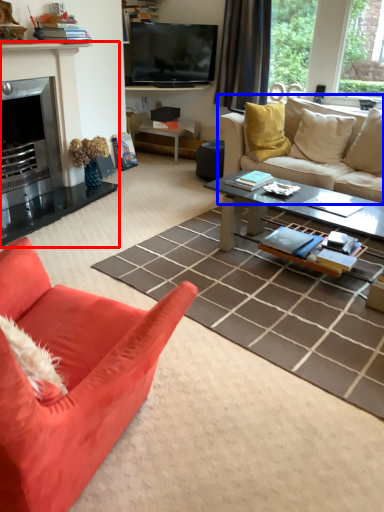
Question: Which object is further to the camera taking this photo, fireplace (highlighted by a red box) or studio couch (highlighted by a blue box)?

Choices:
 (A) fireplace
 (B) studio couch

Answer: (B)